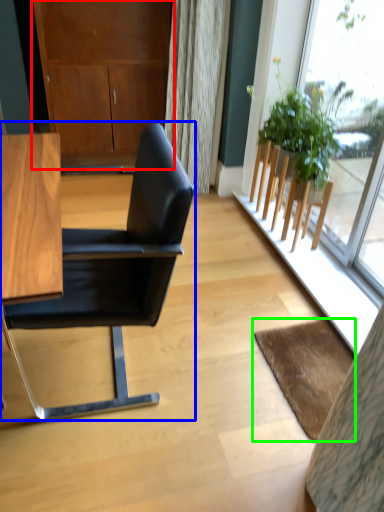
Question: Estimate the real-world distances between objects in this image. Which object is closer to dresser (highlighted by a red box), chair (highlighted by a blue box) or mat (highlighted by a green box)?

Choices:
 (A) chair
 (B) mat

Answer: (A)